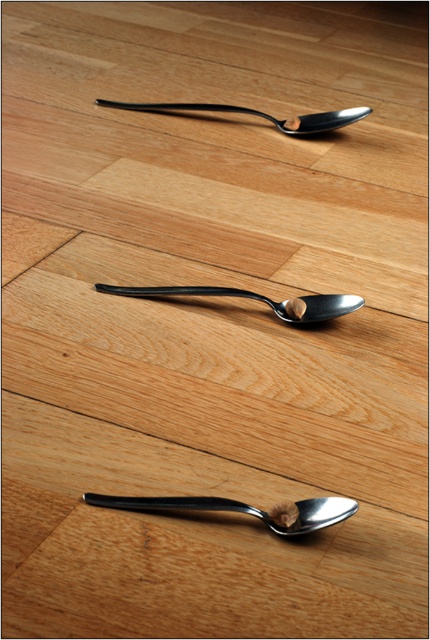
Which is more to the left, polished metal spoon at center or polished metal spoon at upper center?

Positioned to the left is polished metal spoon at center.

Is point (106, 502) farther from camera compared to point (349, 113)?

That is False.

Identify the location of polished metal spoon at center. (242, 509).

Is satin black spoon at center positioned behind polished metal spoon at upper center?

No.

Is satin black spoon at center to the right of polished metal spoon at upper center from the viewer's perspective?

Yes, satin black spoon at center is to the right of polished metal spoon at upper center.

Is point (132, 289) farther from viewer compared to point (104, 99)?

No, it is not.

You are a GUI agent. You are given a task and a screenshot of the screen. Output one action in this format:
    pyautogui.click(x=<x>, y=<y>)
    Task: Click on the satin black spoon at center
    The height and width of the screenshot is (640, 430).
    Given the screenshot: What is the action you would take?
    pyautogui.click(x=254, y=298)

Does polished metal spoon at center have a greater height compared to satin black spoon at center?

In fact, polished metal spoon at center may be shorter than satin black spoon at center.

Who is lower down, polished metal spoon at center or satin black spoon at center?

polished metal spoon at center is lower down.

The height and width of the screenshot is (640, 430). I want to click on polished metal spoon at center, so click(242, 509).